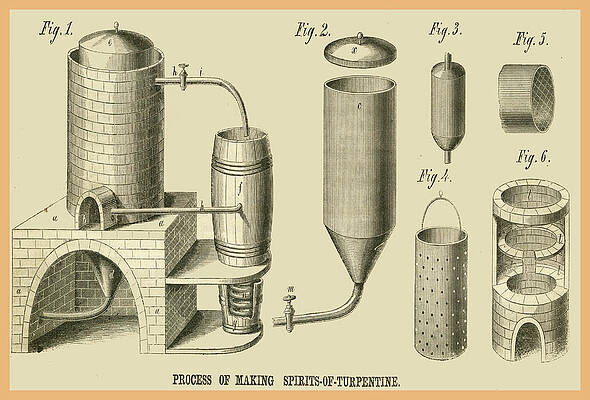
Where is `vessel lid`? Image resolution: width=590 pixels, height=400 pixels. vessel lid is located at coordinates (371, 50).